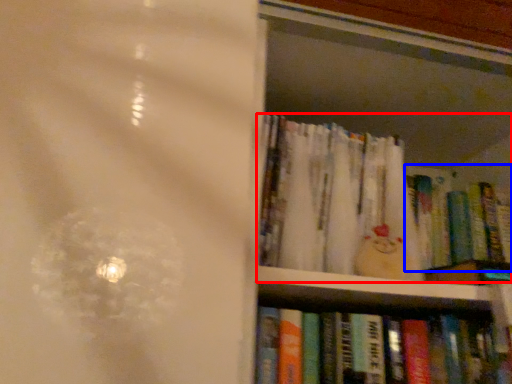
Question: Which point is further to the camera, book (highlighted by a red box) or book (highlighted by a blue box)?

Choices:
 (A) book
 (B) book

Answer: (B)